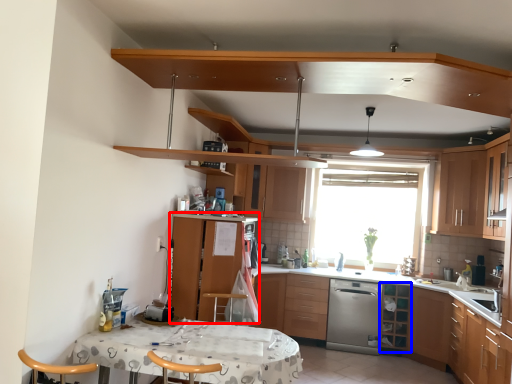
Question: Which object is closer to the camera taking this photo, cabinetry (highlighted by a red box) or shelf (highlighted by a blue box)?

Choices:
 (A) cabinetry
 (B) shelf

Answer: (A)